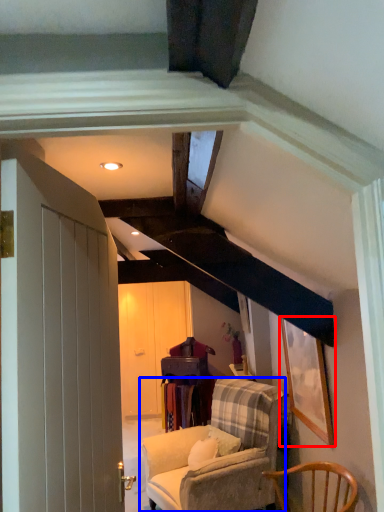
Question: Which of the following is the closest to the observer, picture frame (highlighted by a red box) or chair (highlighted by a blue box)?

Choices:
 (A) picture frame
 (B) chair

Answer: (A)